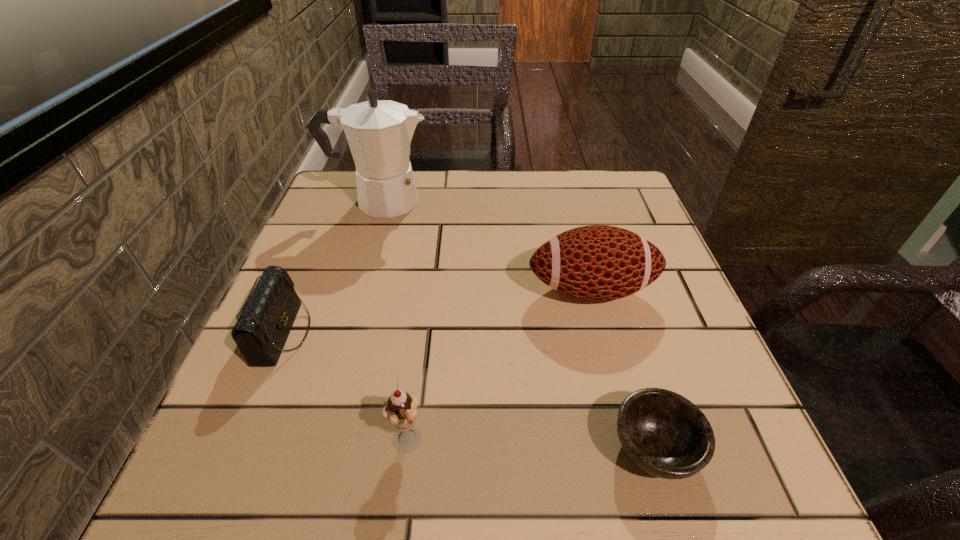
The width and height of the screenshot is (960, 540). What are the coordinates of `vacant space that satisfies the following two spatial constraints: 1. at the spout of the coffeepot; 2. on the left side of the football` in the screenshot? It's located at (352, 290).

Identify the location of free location that satisfies the following two spatial constraints: 1. on the front side of the shortest object; 2. on the left side of the icecream. The image size is (960, 540). (406, 448).